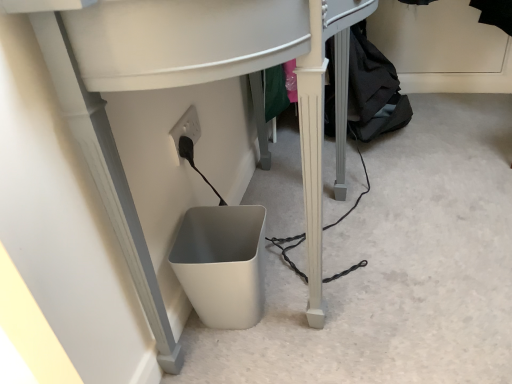
Locate an element on the screen. Image resolution: width=512 pixels, height=384 pixels. vacant area that is in front of black fabric at lower right is located at coordinates (418, 170).